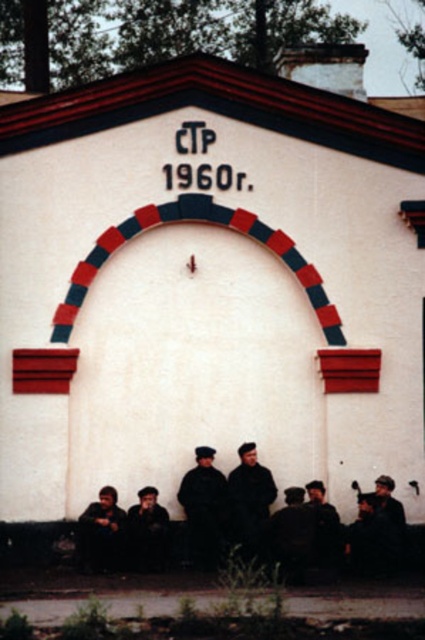
From the picture: Is dark gray uniform at center smaller than dark brown leather jacket at lower left?

No.

Is dark gray uniform at center further to the viewer compared to dark brown leather jacket at lower left?

Yes, dark gray uniform at center is further from the viewer.

Where is `dark gray uniform at center`? dark gray uniform at center is located at coordinates (204, 508).